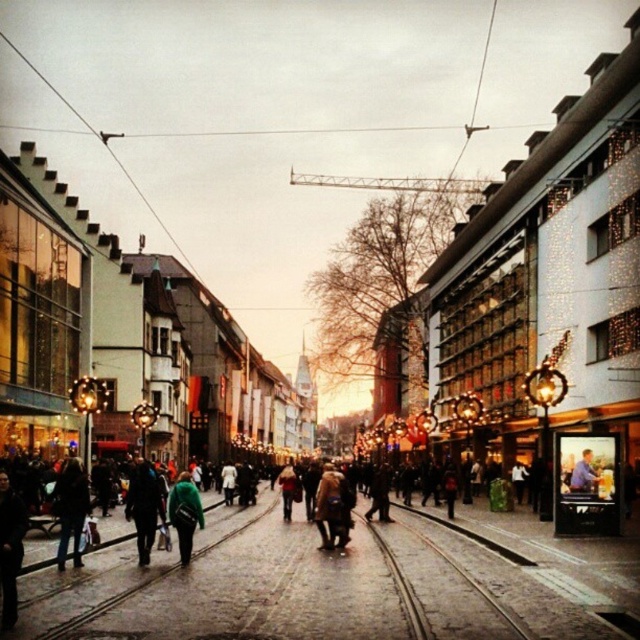
Question: Which point is closer to the camera?

Choices:
 (A) (342, 481)
 (B) (189, 529)
 (C) (440, 554)

Answer: (B)

Question: Among these points, which one is nearest to the camera?

Choices:
 (A) (497, 605)
 (B) (580, 465)

Answer: (A)

Question: Is dark blue jacket at lower left bigger than dark blue jacket at center?

Choices:
 (A) yes
 (B) no

Answer: (B)

Question: Can you confirm if dark blue jacket at lower left is positioned to the right of green fabric jacket at center?

Choices:
 (A) no
 (B) yes

Answer: (A)

Question: Which point is farther to the camera?

Choices:
 (A) dark gray coat at lower left
 (B) blue denim jacket at center
 (C) brown leather jacket at center

Answer: (C)

Question: Can you confirm if green fabric jacket at center is positioned to the left of blue denim jacket at center?

Choices:
 (A) no
 (B) yes

Answer: (B)